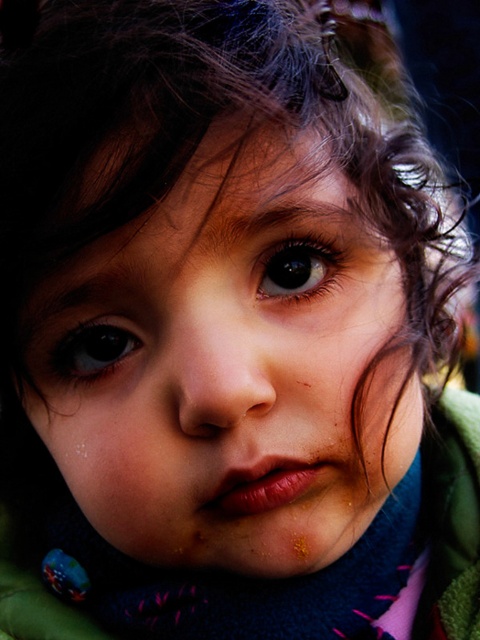
Which is below, matte blue scarf at center or brown glossy eye at center?

Positioned lower is matte blue scarf at center.

What do you see at coordinates (231, 365) in the screenshot?
I see `matte blue scarf at center` at bounding box center [231, 365].

You are a GUI agent. You are given a task and a screenshot of the screen. Output one action in this format:
    pyautogui.click(x=<x>, y=<y>)
    Task: Click on the matte blue scarf at center
    
    Given the screenshot: What is the action you would take?
    pyautogui.click(x=231, y=365)

At what (x,y) coordinates should I click in order to perform the action: click on brown glossy eye at center. Please return your answer as a coordinate pair (x, y). The image size is (480, 640). Looking at the image, I should click on (92, 348).

Measure the distance between brown glossy eye at center and camera.

31.96 centimeters

Image resolution: width=480 pixels, height=640 pixels. Find the location of `brown glossy eye at center`. brown glossy eye at center is located at coordinates (92, 348).

The image size is (480, 640). I want to click on brown glossy eye at center, so click(x=92, y=348).

Can you confirm if matte blue scarf at center is positioned to the left of brown glossy eye at upper center?

Indeed, matte blue scarf at center is positioned on the left side of brown glossy eye at upper center.

Does matte blue scarf at center have a lesser height compared to brown glossy eye at upper center?

No, matte blue scarf at center is not shorter than brown glossy eye at upper center.

Which is in front, point (295, 164) or point (297, 266)?

Point (295, 164) is more forward.

Locate an element on the screen. This screenshot has height=640, width=480. matte blue scarf at center is located at coordinates (231, 365).